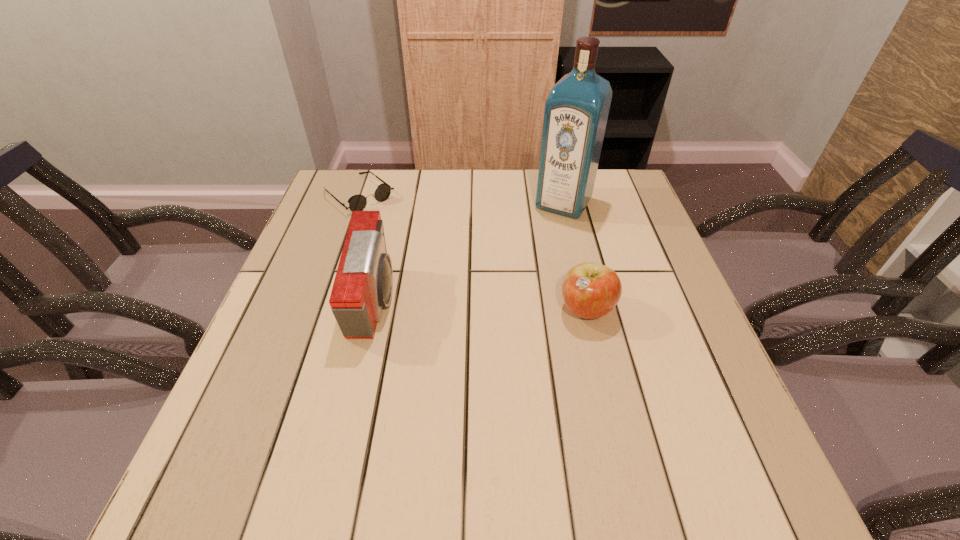
At what (x,y) coordinates should I click in order to perform the action: click on free space that is in between the apple and the tallest object. Please return your answer as a coordinate pair (x, y). Looking at the image, I should click on (575, 256).

This screenshot has height=540, width=960. Find the location of `unoccupied position between the liquor and the second tallest object`. unoccupied position between the liquor and the second tallest object is located at coordinates (469, 253).

At what (x,y) coordinates should I click in order to perform the action: click on free space between the sunglasses and the tallest object. Please return your answer as a coordinate pair (x, y). Looking at the image, I should click on (461, 199).

Identify the location of unoccupied area between the second shortest object and the liquor. This screenshot has height=540, width=960. (575, 256).

This screenshot has width=960, height=540. What are the coordinates of `object that is the closest to the shortest object` in the screenshot? It's located at [x=363, y=284].

At what (x,y) coordinates should I click in order to perform the action: click on object that is the second nearest to the sunglasses. Please return your answer as a coordinate pair (x, y). Looking at the image, I should click on (576, 111).